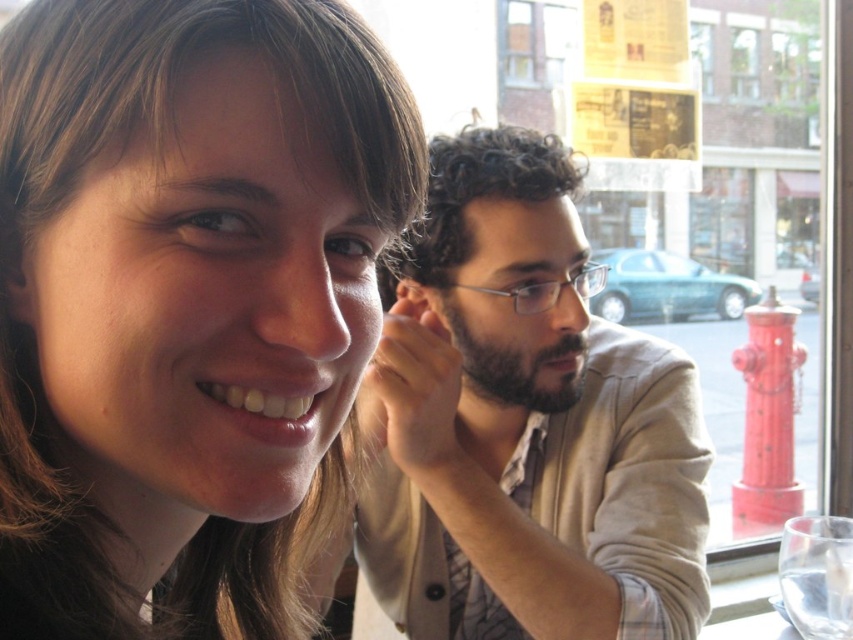
Is matte brown hair at upper left shorter than light beige sweater at center?

Yes, matte brown hair at upper left is shorter than light beige sweater at center.

Is point (341, 360) less distant than point (670, 449)?

That is True.

Where is `matte brown hair at upper left`? matte brown hair at upper left is located at coordinates (186, 304).

Locate an element on the screen. This screenshot has height=640, width=853. matte brown hair at upper left is located at coordinates (186, 304).

Does matte brown hair at upper left have a greater height compared to clear glass at lower right?

Yes.

Is matte brown hair at upper left shorter than clear glass at lower right?

In fact, matte brown hair at upper left may be taller than clear glass at lower right.

Identify the location of matte brown hair at upper left. The image size is (853, 640). (186, 304).

Can you confirm if light beige sweater at center is smaller than clear glass at lower right?

No, light beige sweater at center is not smaller than clear glass at lower right.

How much distance is there between light beige sweater at center and clear glass at lower right?

9.64 inches

What do you see at coordinates (527, 426) in the screenshot? This screenshot has width=853, height=640. I see `light beige sweater at center` at bounding box center [527, 426].

Where is `light beige sweater at center`? light beige sweater at center is located at coordinates (527, 426).